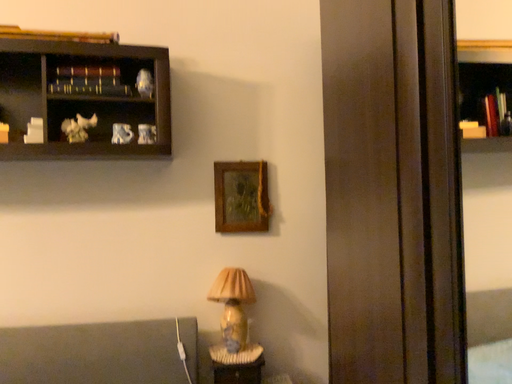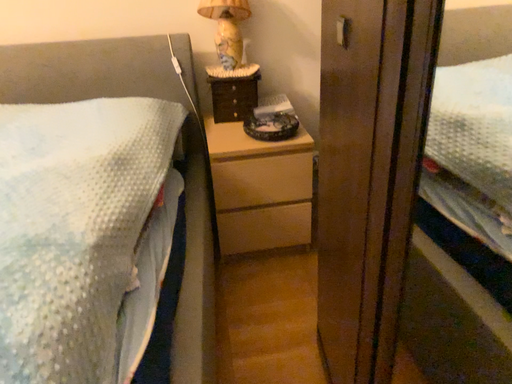
Question: Which way did the camera rotate in the video?

Choices:
 (A) rotated downward
 (B) rotated upward

Answer: (A)